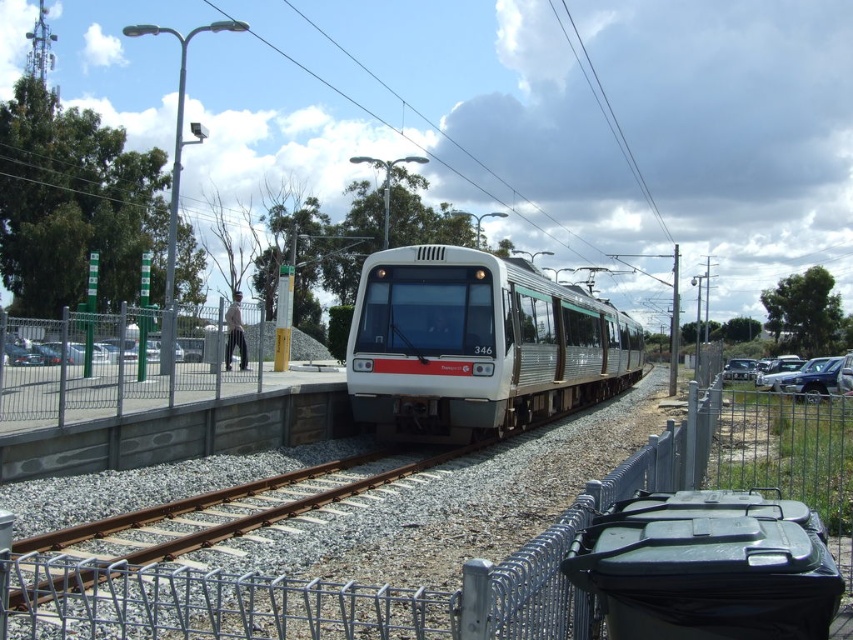
Question: Which point appears closest to the camera in this image?

Choices:
 (A) (758, 385)
 (B) (480, 342)
 (C) (260, 496)

Answer: (C)

Question: Which object is closer to the camera taking this photo?

Choices:
 (A) metallic silver car at right
 (B) white glossy train at center
 (C) rusty metal train track at center

Answer: (C)

Question: Can you confirm if white glossy train at center is bigger than metallic silver car at right?

Choices:
 (A) yes
 (B) no

Answer: (A)

Question: Does white glossy train at center come behind metallic silver car at right?

Choices:
 (A) yes
 (B) no

Answer: (B)

Question: Does white glossy train at center appear on the left side of metallic silver car at right?

Choices:
 (A) no
 (B) yes

Answer: (B)

Question: Which object appears farthest from the camera in this image?

Choices:
 (A) rusty metal train track at center
 (B) white glossy train at center
 (C) metallic silver car at right

Answer: (C)